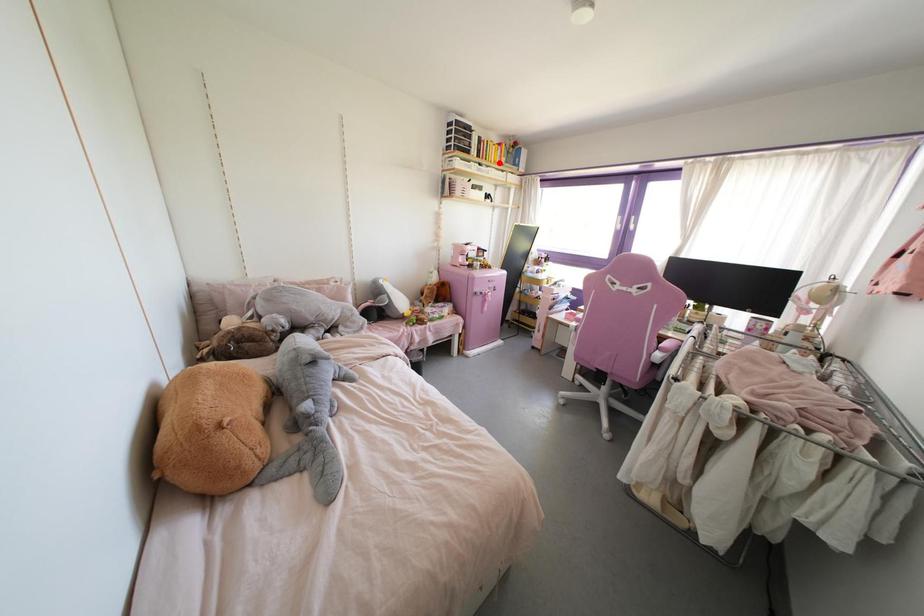
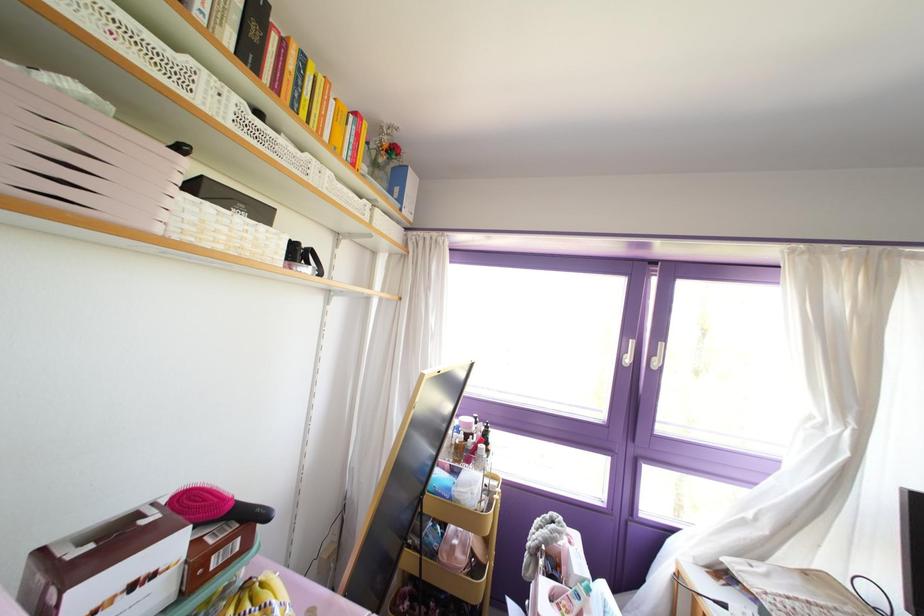
Question: I am providing you with two images of the same scene from different viewpoints. Given a red point in image1, look at the same physical point in image2. Is it:

Choices:
 (A) Closer to the viewpoint
 (B) Farther from the viewpoint

Answer: (B)